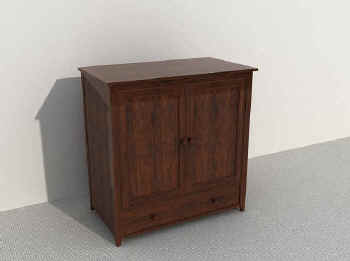
Where is `gray floor`? The width and height of the screenshot is (350, 261). gray floor is located at coordinates [x=231, y=235].